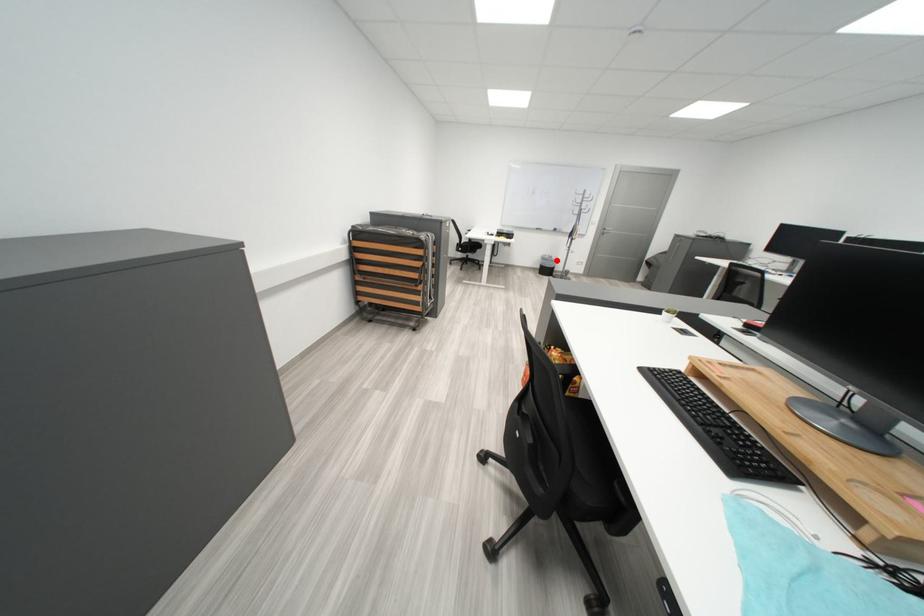
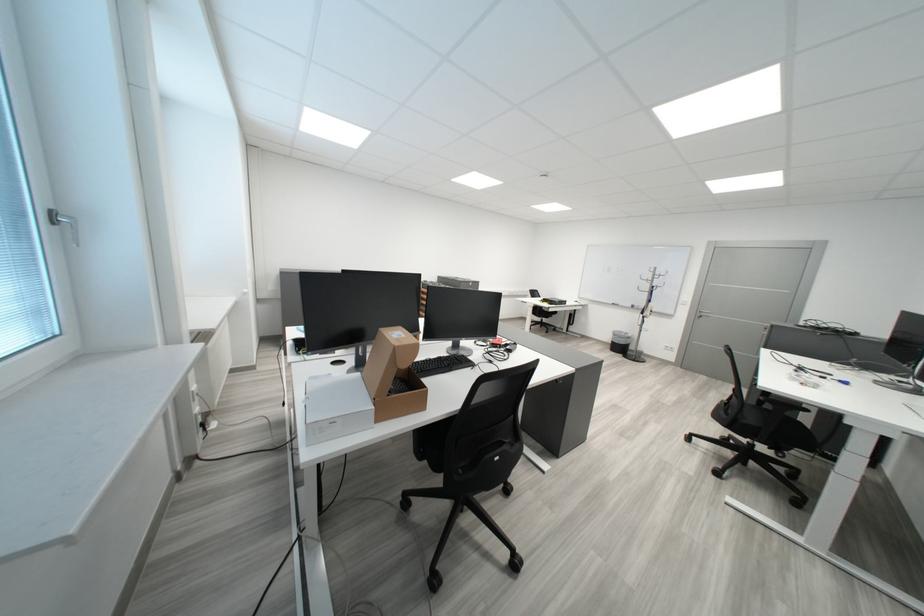
Question: I am providing you with two images of the same scene from different viewpoints. In image1, a red point is highlighted. Considering the same 3D point in image2, which of the following is correct?

Choices:
 (A) It is closer
 (B) It is farther

Answer: (B)